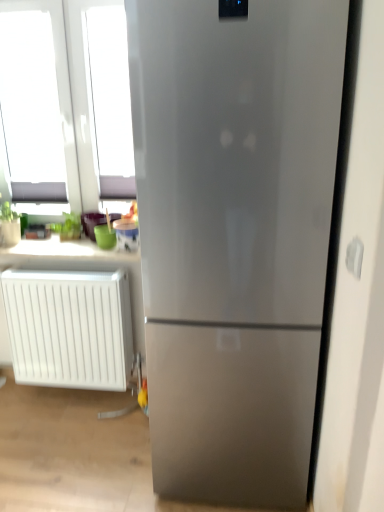
The height and width of the screenshot is (512, 384). Find the location of `white plastic electric outlet at right`. white plastic electric outlet at right is located at coordinates (354, 257).

Can you confirm if white plastic electric outlet at right is bigger than matte white counter top at upper left?

Actually, white plastic electric outlet at right might be smaller than matte white counter top at upper left.

Where is `electric outlet in front of the matte white counter top at upper left`? Image resolution: width=384 pixels, height=512 pixels. electric outlet in front of the matte white counter top at upper left is located at coordinates (354, 257).

Is white plastic electric outlet at right oriented away from matte white counter top at upper left?

That's not correct — white plastic electric outlet at right is not looking away from matte white counter top at upper left.

Which object is thinner, white plastic electric outlet at right or matte white counter top at upper left?

With smaller width is white plastic electric outlet at right.

Does white plastic radiator at lower left lie in front of matte white counter top at upper left?

Yes, white plastic radiator at lower left is in front of matte white counter top at upper left.

From a real-world perspective, who is located higher, white plastic radiator at lower left or matte white counter top at upper left?

matte white counter top at upper left, from a real-world perspective.

Are white plastic radiator at lower left and matte white counter top at upper left located far from each other?

No, white plastic radiator at lower left is not far from matte white counter top at upper left.

Does white plastic radiator at lower left have a smaller size compared to matte white counter top at upper left?

Incorrect, white plastic radiator at lower left is not smaller in size than matte white counter top at upper left.

Is white plastic electric outlet at right not within white plastic radiator at lower left?

That's correct, white plastic electric outlet at right is outside of white plastic radiator at lower left.

From a real-world perspective, is white plastic electric outlet at right positioned under white plastic radiator at lower left based on gravity?

No.

Where is `electric outlet above the white plastic radiator at lower left (from a real-world perspective)`? electric outlet above the white plastic radiator at lower left (from a real-world perspective) is located at coordinates (354, 257).

From the image's perspective, between white plastic electric outlet at right and white plastic radiator at lower left, which one is located above?

white plastic electric outlet at right is shown above in the image.

Is white plastic radiator at lower left looking in the opposite direction of white plastic electric outlet at right?

No, white plastic radiator at lower left's orientation is not away from white plastic electric outlet at right.

What's the angular difference between white plastic radiator at lower left and white plastic electric outlet at right's facing directions?

The facing directions of white plastic radiator at lower left and white plastic electric outlet at right are 88.2 degrees apart.

Which of these two, white plastic radiator at lower left or white plastic electric outlet at right, is bigger?

Bigger between the two is white plastic radiator at lower left.

Based on their positions, is white plastic radiator at lower left located to the left or right of white plastic electric outlet at right?

white plastic radiator at lower left is to the left of white plastic electric outlet at right.

Which is closer, [84,248] or [129,367]?

Point [84,248] is positioned closer to the camera compared to point [129,367].

Which object is positioned more to the left, matte white counter top at upper left or white plastic radiator at lower left?

white plastic radiator at lower left is more to the left.

Is white plastic radiator at lower left at the back of matte white counter top at upper left?

No, matte white counter top at upper left's orientation is not away from white plastic radiator at lower left.

Considering the sizes of matte white counter top at upper left and white plastic radiator at lower left in the image, is matte white counter top at upper left bigger or smaller than white plastic radiator at lower left?

In the image, matte white counter top at upper left appears to be smaller than white plastic radiator at lower left.

How different are the orientations of matte white counter top at upper left and white plastic electric outlet at right in degrees?

The angular difference between matte white counter top at upper left and white plastic electric outlet at right is 88.8 degrees.

From a real-world perspective, is matte white counter top at upper left located beneath white plastic electric outlet at right?

Yes, from a real-world perspective, matte white counter top at upper left is under white plastic electric outlet at right.

Identify the location of counter top that is under the white plastic electric outlet at right (from a real-world perspective). (63, 251).

Which of these two, matte white counter top at upper left or white plastic electric outlet at right, is bigger?

With larger size is matte white counter top at upper left.

This screenshot has height=512, width=384. Identify the location of electric outlet that is below the matte white counter top at upper left (from the image's perspective). [354, 257].

Find the location of a particular element. radiator lying on the left of matte white counter top at upper left is located at coordinates (69, 328).

Based on their spatial positions, is matte white counter top at upper left or white plastic electric outlet at right closer to white plastic radiator at lower left?

Based on the image, matte white counter top at upper left appears to be nearer to white plastic radiator at lower left.

From the image, which object appears to be nearer to matte white counter top at upper left, white plastic radiator at lower left or white plastic electric outlet at right?

Among the two, white plastic radiator at lower left is located nearer to matte white counter top at upper left.

Looking at the image, which one is located closer to matte white counter top at upper left, white plastic electric outlet at right or white plastic radiator at lower left?

Among the two, white plastic radiator at lower left is located nearer to matte white counter top at upper left.

Looking at the image, which one is located closer to white plastic electric outlet at right, matte white counter top at upper left or white plastic radiator at lower left?

Based on the image, white plastic radiator at lower left appears to be nearer to white plastic electric outlet at right.

Which object lies nearer to the anchor point white plastic radiator at lower left, white plastic electric outlet at right or matte white counter top at upper left?

matte white counter top at upper left is closer to white plastic radiator at lower left.

Looking at the image, which one is located closer to white plastic electric outlet at right, white plastic radiator at lower left or matte white counter top at upper left?

The object closer to white plastic electric outlet at right is white plastic radiator at lower left.

Where is `counter top between white plastic radiator at lower left and white plastic electric outlet at right from left to right`? This screenshot has width=384, height=512. counter top between white plastic radiator at lower left and white plastic electric outlet at right from left to right is located at coordinates (63, 251).